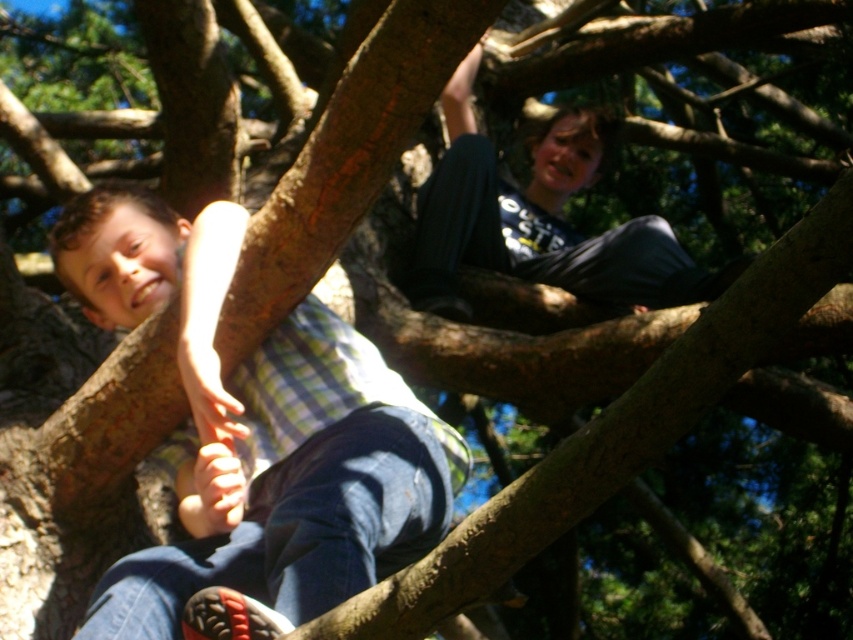
You are a photographer taking a picture of the two children climbing the tree. You notice a point at coordinates (258, 429). What object is located at that point?

The point at coordinates (258, 429) indicates the checkered fabric shirt at center.